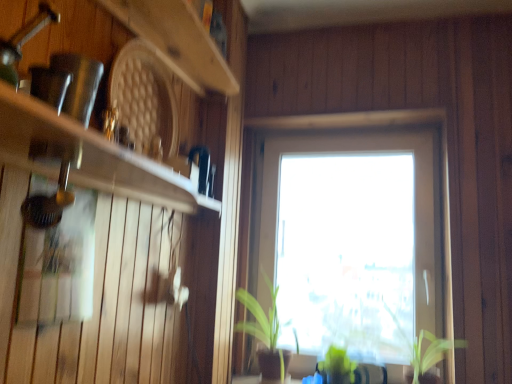
Question: Considering the positions of green leafy plant at lower center, the second plant in the left-to-right sequence, and green matte plant at center, placed as the first plant when sorted from left to right, in the image, is green leafy plant at lower center, the second plant in the left-to-right sequence, bigger or smaller than green matte plant at center, placed as the first plant when sorted from left to right,?

Choices:
 (A) small
 (B) big

Answer: (A)

Question: Considering the positions of green leafy plant at lower center, the 2th plant from the right, and green matte plant at center, which ranks as the third plant in right-to-left order, in the image, is green leafy plant at lower center, the 2th plant from the right, taller or shorter than green matte plant at center, which ranks as the third plant in right-to-left order,?

Choices:
 (A) tall
 (B) short

Answer: (B)

Question: Which object is positioned farthest from the transparent glass window at center?

Choices:
 (A) wooden at upper left, which appears as the first shelf when viewed from the top
 (B) matte white shelf at left, the first shelf in the bottom-to-top sequence
 (C) green leafy plant at lower center, the 2th plant from the right
 (D) green matte plant at center, which ranks as the third plant in right-to-left order
 (E) green leafy plant at lower right, the first plant positioned from the right

Answer: (B)

Question: Which object is positioned closest to the green leafy plant at lower right, the 3th plant viewed from the left?

Choices:
 (A) matte white shelf at left, the first shelf in the bottom-to-top sequence
 (B) green matte plant at center, placed as the first plant when sorted from left to right
 (C) wooden at upper left, which appears as the first shelf when viewed from the top
 (D) transparent glass window at center
 (E) green leafy plant at lower center, the second plant in the left-to-right sequence

Answer: (E)